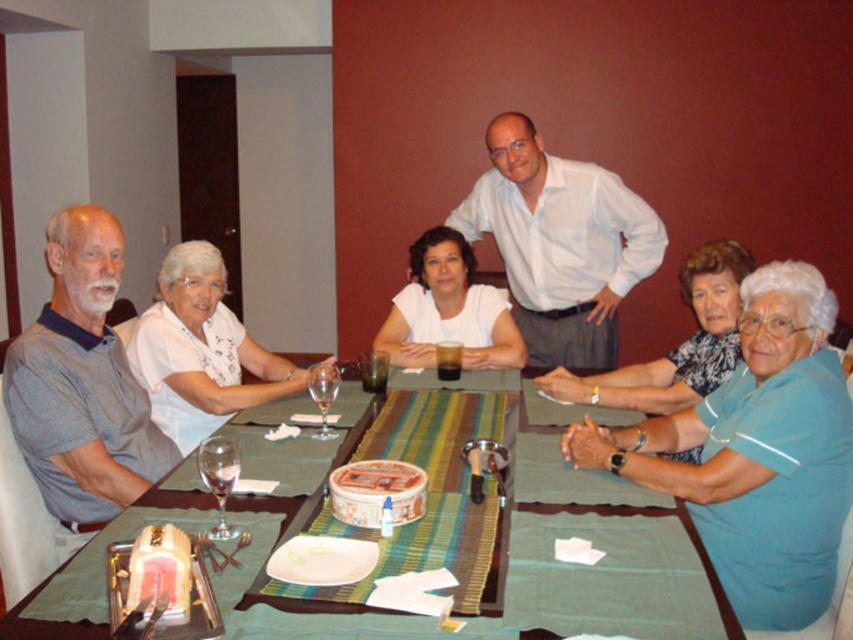
Question: Which object is the farthest from the smooth plastic container at center?

Choices:
 (A) transparent glass wine glass at center
 (B) matte white shirt at center
 (C) blue cotton shirt at lower right
 (D) white fabric shirt at left

Answer: (B)

Question: Among these objects, which one is nearest to the camera?

Choices:
 (A) pink glossy cake at lower left
 (B) matte white shirt at center

Answer: (A)

Question: Is blue cotton shirt at lower right smaller than smooth chocolate cake at center?

Choices:
 (A) yes
 (B) no

Answer: (B)

Question: Is gray cotton shirt at left to the left of white fabric shirt at left from the viewer's perspective?

Choices:
 (A) yes
 (B) no

Answer: (A)

Question: Among these objects, which one is nearest to the camera?

Choices:
 (A) white shirt at center
 (B) blue cotton shirt at lower right
 (C) matte white shirt at center

Answer: (B)

Question: Does blue cotton shirt at lower right appear on the left side of smooth plastic container at center?

Choices:
 (A) no
 (B) yes

Answer: (A)